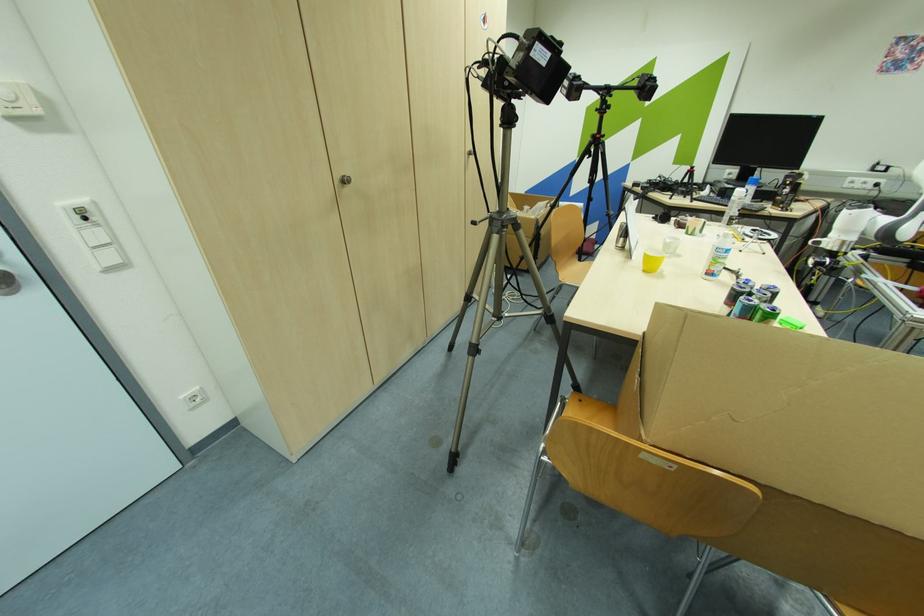
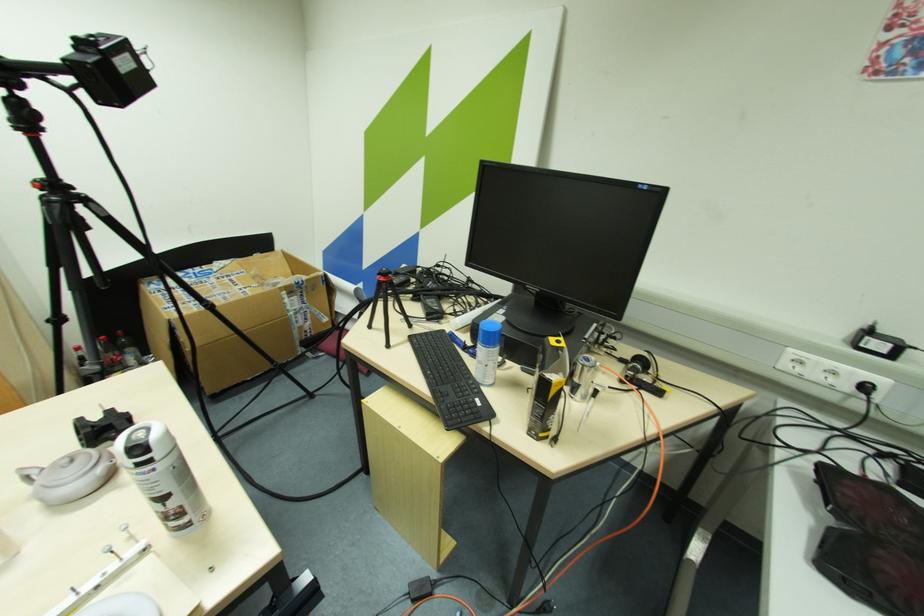
In a continuous first-person perspective shot, in which direction is the camera moving?

The cameraman moved toward right, forward.